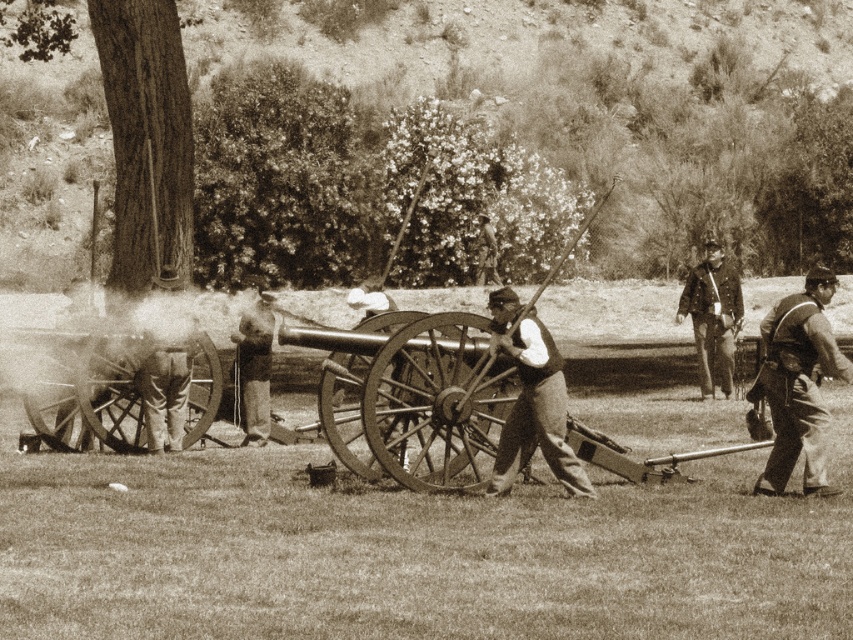
You are a photographer standing at the camera position. You want to capture a closeup shot of the rustic leather vest at right. Given that your camera has a minimum focusing distance of 10 meters, will you be able to take the photo without moving closer?

The distance between the rustic leather vest at right and the camera is 12.57 meters, which is greater than the minimum focusing distance of 10 meters. Therefore, you can take the closeup shot without moving closer.